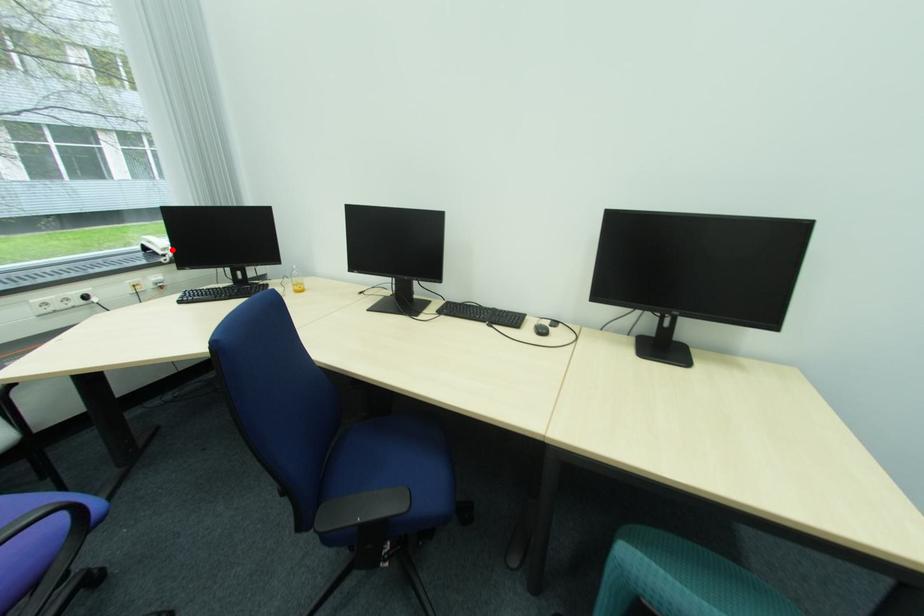
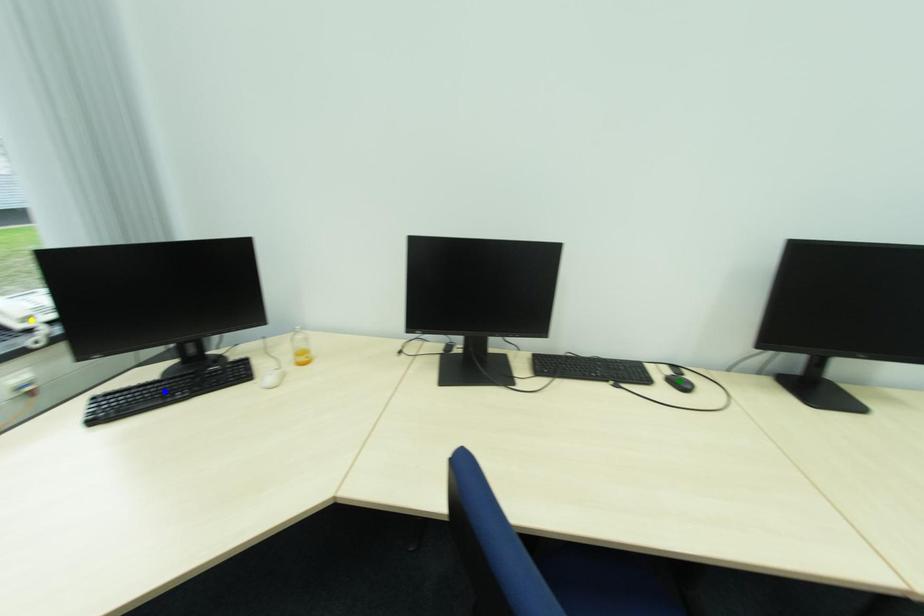
Question: I am providing you with two images of the same scene from different viewpoints. A red point is marked on the first image. You are given multiple points on the second image. In image 2, which mark is for the same physical point as the one in image 1?

Choices:
 (A) yellow point
 (B) blue point
 (C) green point

Answer: (A)